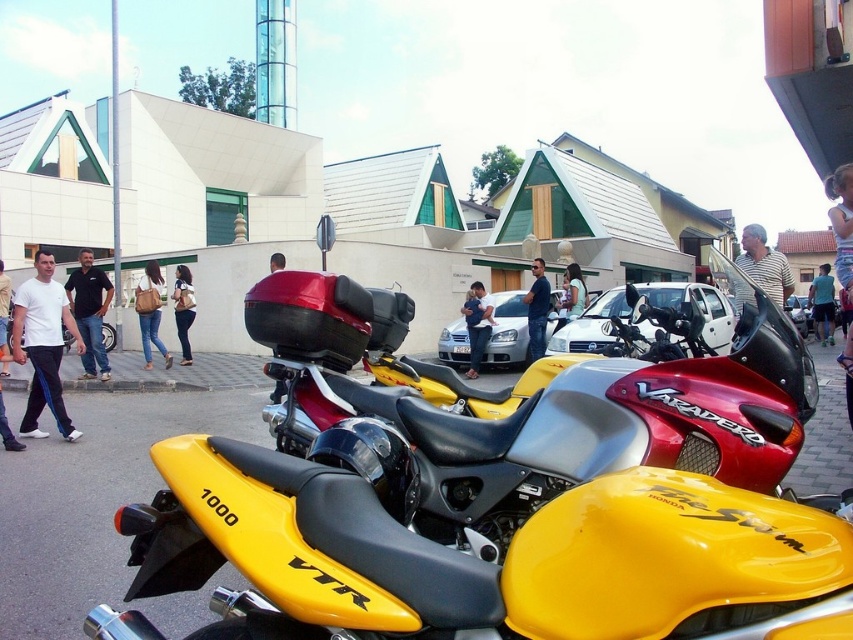
You are a photographer standing at the center of the street scene. You want to take a photo that includes both the yellow and black motorcycle labeled VTR 1000 and the red and black motorcycle marked Varadero. However, you notice two points in the image at coordinates point (183, 336) and point (3, 326). Which point is closer to your camera position?

Point (3, 326) is closer to the camera because the description states that point (183, 336) is further away than point (3, 326).

You are a photographer standing in front of the motorcycles. You notice a person wearing a white shirt at left and denim pants at center. Which clothing item is closer to you?

The denim pants at center are closer to you because the white shirt at left is behind them.

Consider the image. You are a photographer standing at the edge of the street. You want to take a photo of the black shirt at center and light blue denim jeans at center. If your camera has a maximum focus range of 5 meters, will you be able to capture both subjects clearly in the same frame?

The black shirt at center is 7.90 meters away from light blue denim jeans at center. Since the maximum focus range is 5 meters, the distance between them exceeds this limit, so you cannot capture both clearly in the same frame.